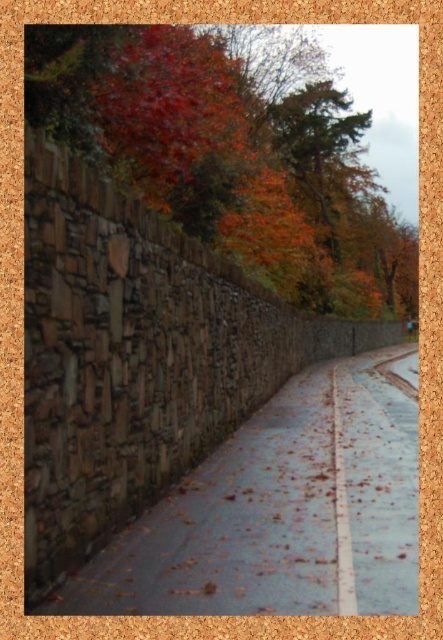
You are a gardener planning to clear the autumn leaves at upper center and the rustic stone path at center. Which area requires more effort to clear based on their sizes?

The autumn leaves at upper center requires more effort to clear because it is larger in size than the rustic stone path at center.